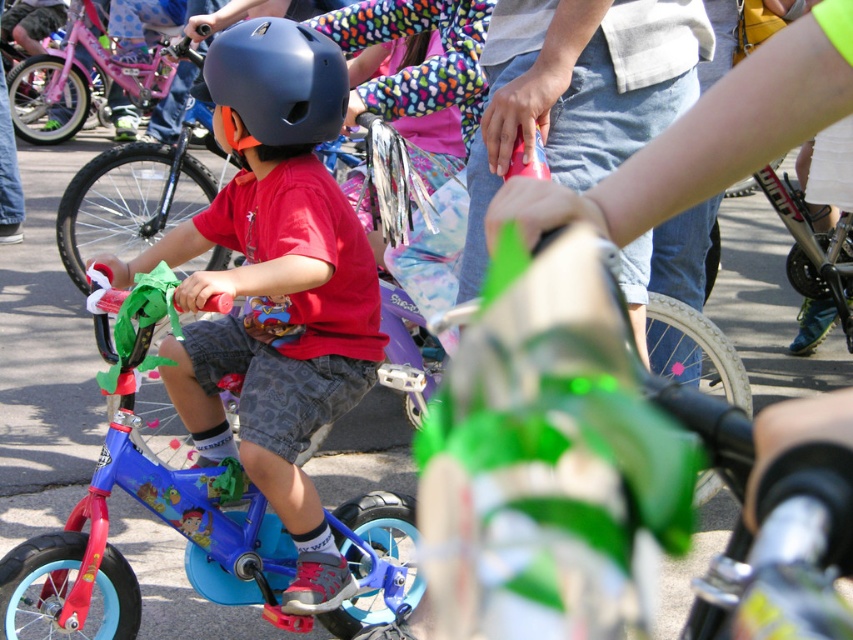
Question: Can you confirm if blue plastic bicycle at center is positioned to the left of denim jeans at center?

Choices:
 (A) yes
 (B) no

Answer: (A)

Question: Which point is farther from the camera taking this photo?

Choices:
 (A) (672, 58)
 (B) (345, 81)

Answer: (B)

Question: Which object appears farthest from the camera in this image?

Choices:
 (A) matte black helmet at center
 (B) pink matte bicycle at left

Answer: (B)

Question: Can you confirm if matte blue helmet at center is positioned above denim jeans at center?

Choices:
 (A) yes
 (B) no

Answer: (B)

Question: Which of the following is the farthest from the observer?

Choices:
 (A) denim jeans at center
 (B) matte black helmet at center
 (C) matte blue helmet at center

Answer: (B)

Question: Observing the image, what is the correct spatial positioning of matte black helmet at center in reference to pink matte bicycle at left?

Choices:
 (A) above
 (B) below

Answer: (B)